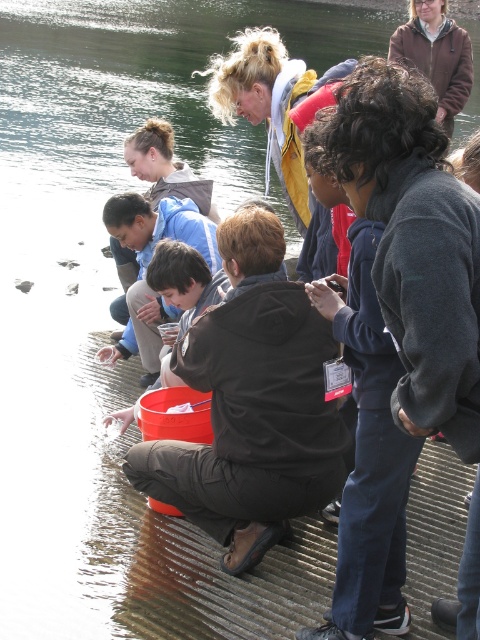
You are a photographer trying to capture a closeup of the red bucket while ensuring both the black matte jacket at center and the dark gray fleece jacket at center are visible in the frame. Which jacket should you focus on to ensure both are in the shot?

The black matte jacket at center is much taller than the dark gray fleece jacket at center, so focusing on the black matte jacket at center will ensure both are visible in the frame.

You are a photographer standing at the edge of the water and want to take a photo of both point (319,332) and point (352,76). Which point will appear closer to the bottom of the photo?

Point (352,76) will appear closer to the bottom of the photo because it is closer to the camera than point (319,332).

You are standing at the point labeled as point (x=252, y=404) in the image. What object is directly beneath your feet?

The point (x=252, y=404) is on the black matte jacket at center, so the object directly beneath your feet is the black matte jacket at center.